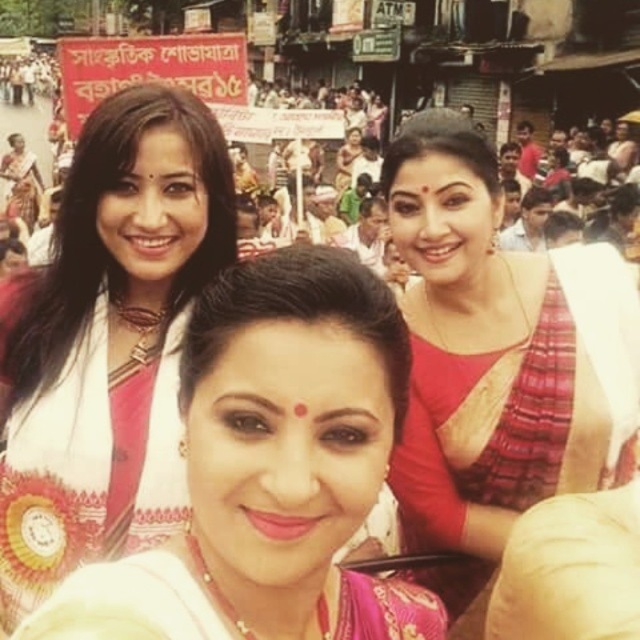
Does pink satin saree at center appear on the right side of matte red saree at upper right?

In fact, pink satin saree at center is to the left of matte red saree at upper right.

Between point (234, 531) and point (465, 492), which one is positioned behind?

The point (465, 492) is behind.

Measure the distance between point (x=240, y=314) and camera.

Point (x=240, y=314) and camera are 36.81 meters apart.

Identify the location of pink satin saree at center. (292, 448).

Does matte white saree at upper left appear over matte red saree at upper right?

Indeed, matte white saree at upper left is positioned over matte red saree at upper right.

Which is more to the left, matte white saree at upper left or matte red saree at upper right?

matte white saree at upper left is more to the left.

You are a GUI agent. You are given a task and a screenshot of the screen. Output one action in this format:
    pyautogui.click(x=<x>, y=<y>)
    Task: Click on the matte white saree at upper left
    This screenshot has width=640, height=640.
    Given the screenshot: What is the action you would take?
    pyautogui.click(x=109, y=340)

Where is `matte white saree at upper left`? Image resolution: width=640 pixels, height=640 pixels. matte white saree at upper left is located at coordinates (109, 340).

Does point (252, 330) come closer to viewer compared to point (65, 531)?

Yes.

Can you confirm if pink satin saree at center is thinner than matte white saree at upper left?

No.

Which is behind, point (298, 301) or point (131, 225)?

Point (131, 225)

This screenshot has width=640, height=640. What are the coordinates of `pink satin saree at center` in the screenshot? It's located at (292, 448).